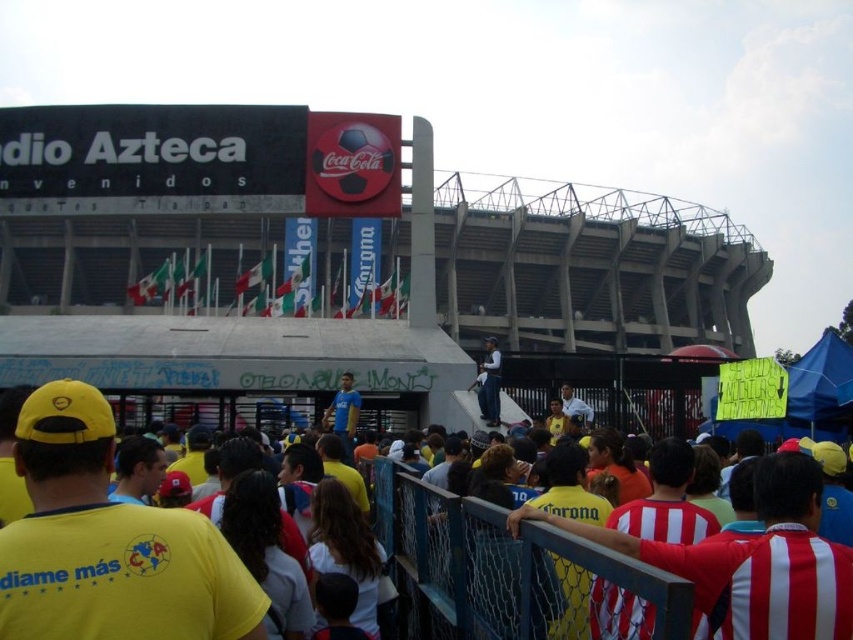
Measure the distance between yellow fabric shirt at center and camera.

They are 26.62 meters apart.

Who is shorter, yellow fabric shirt at center or dark blue uniform at center?

Standing shorter between the two is dark blue uniform at center.

Who is more distant from viewer, [103,563] or [482,394]?

Positioned behind is point [482,394].

Find the location of a particular element. The width and height of the screenshot is (853, 640). yellow fabric shirt at center is located at coordinates (108, 544).